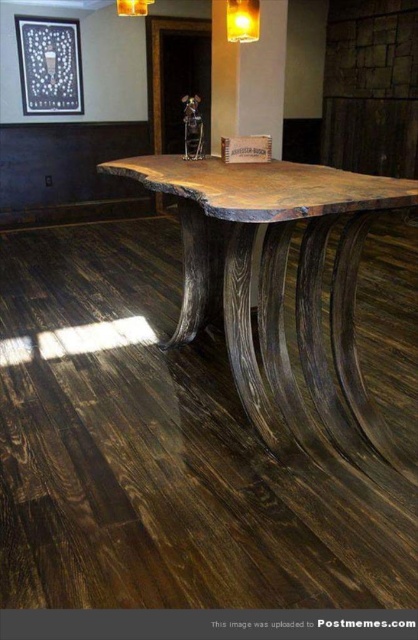
You are a customer in a bar and want to place your drink on the dark wood table at center. However, there is a matte gold lampshade at upper center nearby. Can you place your drink on the table without it being too close to the lampshade?

The dark wood table at center is taller than the matte gold lampshade at upper center, so placing your drink on the table should be safe as it will be above the lampshade. However, ensure the drink is not placed too close to the lampshade to avoid any spills or accidents.

You are a customer at the bar and want to place your drink on the matte yellow glass at upper center. The bartender warns you that the surface might be slippery. Where should you place your drink to avoid it sliding off?

Place your drink on the matte yellow glass at upper center, as the coordinates provided indicate its position, and the matte finish reduces slipperiness compared to glossy surfaces.

Consider the image. You are standing in a bar and want to place a 1.80 meter long banner on the dark wood table at center. Considering your position relative to the table, can you reach the entire length of the banner to place it properly?

The dark wood table at center is 1.70 meters away from you. Since the banner is longer than the distance, you might not be able to reach the entire length without moving closer or using assistance.